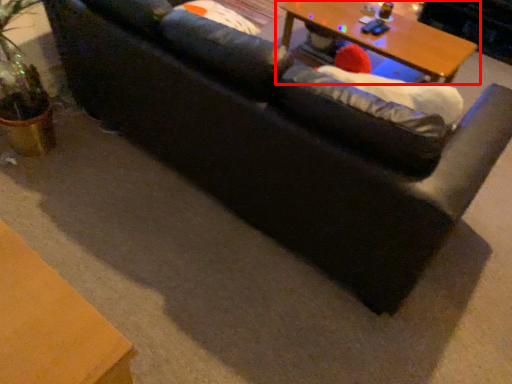
Question: From the image's perspective, what is the correct spatial relationship of table (annotated by the red box) in relation to bean bag chair?

Choices:
 (A) above
 (B) below

Answer: (A)